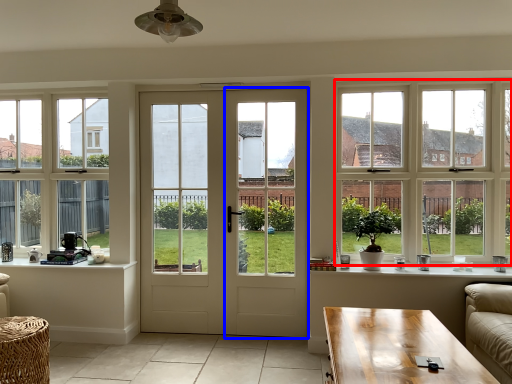
Question: Which object is further to the camera taking this photo, window (highlighted by a red box) or screen door (highlighted by a blue box)?

Choices:
 (A) window
 (B) screen door

Answer: (B)